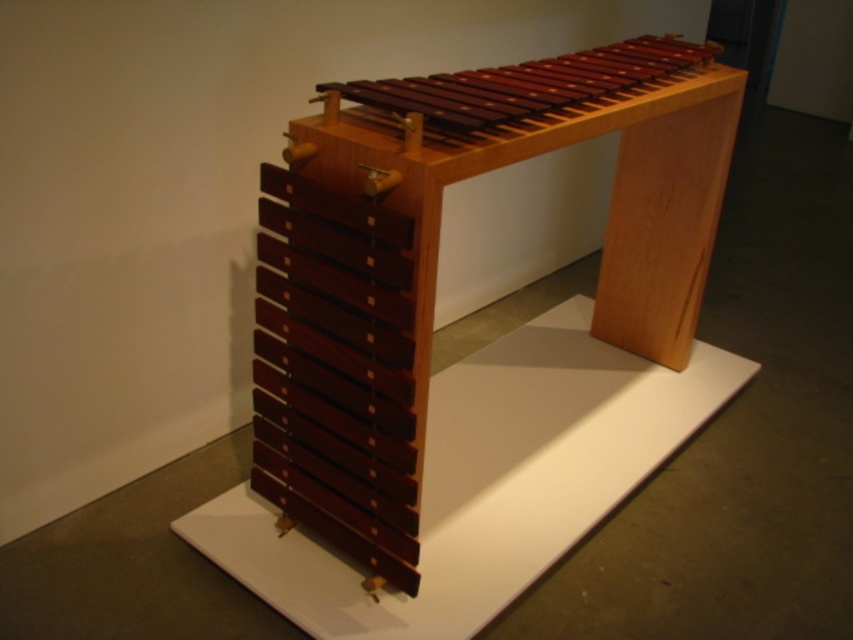
Is mahogany wood xylophone at center to the left of polished wood xylophone at center from the viewer's perspective?

Yes, mahogany wood xylophone at center is to the left of polished wood xylophone at center.

Which is more to the right, mahogany wood xylophone at center or polished wood xylophone at center?

From the viewer's perspective, polished wood xylophone at center appears more on the right side.

Who is more forward, (x=390, y=188) or (x=326, y=113)?

Positioned in front is point (x=390, y=188).

Where is `mahogany wood xylophone at center`? The image size is (853, 640). mahogany wood xylophone at center is located at coordinates (437, 253).